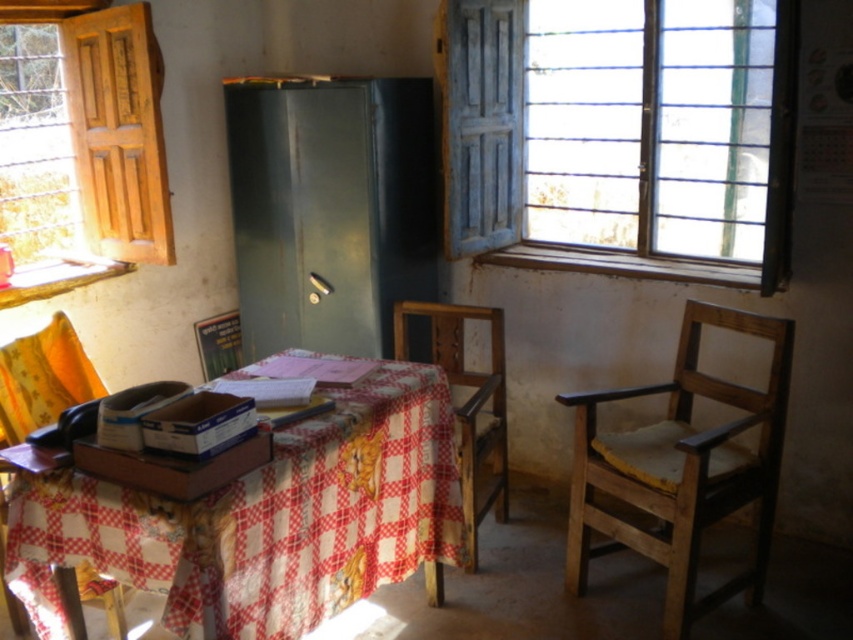
Does blue painted wood at upper right appear over checkered fabric table at center?

Correct, blue painted wood at upper right is located above checkered fabric table at center.

Does blue painted wood at upper right have a greater width compared to checkered fabric table at center?

Yes, blue painted wood at upper right is wider than checkered fabric table at center.

Is point (618, 104) less distant than point (236, 528)?

No, (618, 104) is further to viewer.

The height and width of the screenshot is (640, 853). In order to click on blue painted wood at upper right in this screenshot , I will do `click(622, 134)`.

Is point (300, 554) positioned before point (611, 480)?

Yes, it is in front of point (611, 480).

Is point (407, 465) positioned behind point (579, 524)?

No, (407, 465) is closer to viewer.

Does point (57, 637) lie behind point (694, 465)?

No, (57, 637) is in front of (694, 465).

Find the location of `checkered fabric table at center`. checkered fabric table at center is located at coordinates pos(262,520).

Can you confirm if wooden chair at right is wider than yellow fabric chair at left?

Correct, the width of wooden chair at right exceeds that of yellow fabric chair at left.

Who is taller, wooden chair at right or yellow fabric chair at left?

wooden chair at right is taller.

Is point (750, 406) farther from camera compared to point (68, 355)?

That is False.

Find the location of a particular element. The height and width of the screenshot is (640, 853). wooden chair at right is located at coordinates (682, 468).